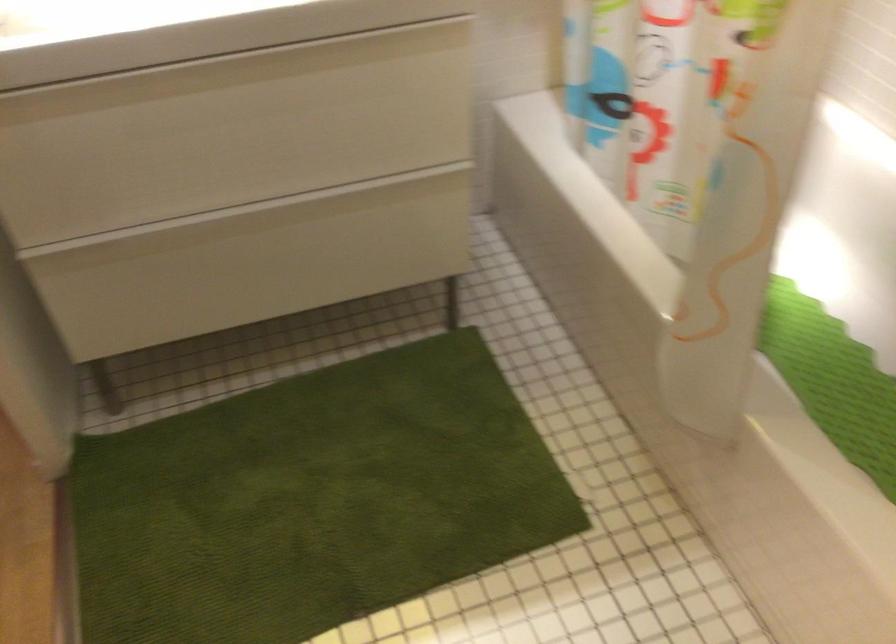
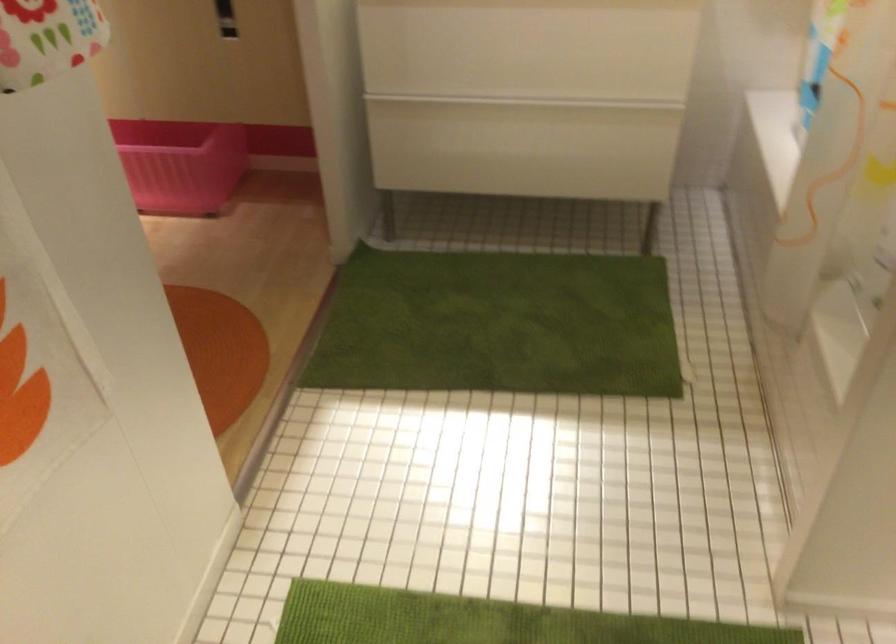
In a continuous first-person perspective shot, in which direction is the camera moving?

The cameraman walked toward right, backward.